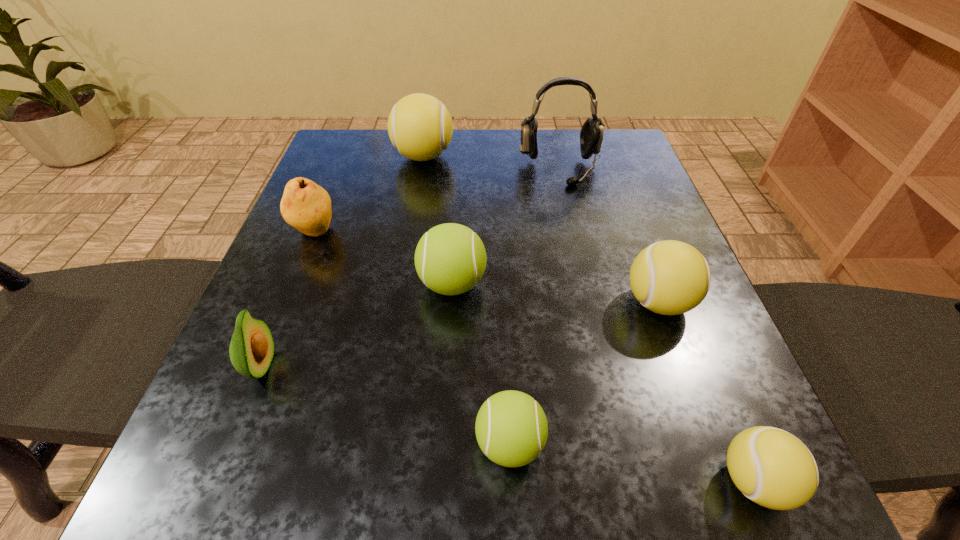
You are a GUI agent. You are given a task and a screenshot of the screen. Output one action in this format:
    pyautogui.click(x=<x>, y=<y>)
    Task: Click on the free point between the bigger green tennis ball and the farthest tennis ball
    The width and height of the screenshot is (960, 540).
    Given the screenshot: What is the action you would take?
    pyautogui.click(x=438, y=220)

Image resolution: width=960 pixels, height=540 pixels. In order to click on free space between the smaller green tennis ball and the biggest yellow tennis ball in this screenshot , I will do [467, 300].

Find the location of a particular element. The width and height of the screenshot is (960, 540). unoccupied area between the pear and the smaller green tennis ball is located at coordinates (412, 338).

You are a GUI agent. You are given a task and a screenshot of the screen. Output one action in this format:
    pyautogui.click(x=<x>, y=<y>)
    Task: Click on the empty location between the second farthest yellow tennis ball and the farthest tennis ball
    The image size is (960, 540).
    Given the screenshot: What is the action you would take?
    pyautogui.click(x=540, y=230)

This screenshot has width=960, height=540. Find the location of `vacant region between the bigger green tennis ball and the second smallest yellow tennis ball`. vacant region between the bigger green tennis ball and the second smallest yellow tennis ball is located at coordinates (555, 293).

The width and height of the screenshot is (960, 540). What are the coordinates of `vacant point located between the bigger green tennis ball and the tallest object` in the screenshot? It's located at (506, 226).

Find the location of `vacant space that's between the farthest yellow tennis ball and the smallest yellow tennis ball`. vacant space that's between the farthest yellow tennis ball and the smallest yellow tennis ball is located at coordinates (588, 319).

This screenshot has width=960, height=540. Identify the location of free spot between the third farthest object and the nearer green tennis ball. (412, 338).

Find the location of a particular element. Image resolution: width=960 pixels, height=540 pixels. vacant area that lies between the leftmost yellow tennis ball and the nearest yellow tennis ball is located at coordinates (588, 319).

Find the location of a particular element. object that is the seventh closest to the second tallest object is located at coordinates (773, 468).